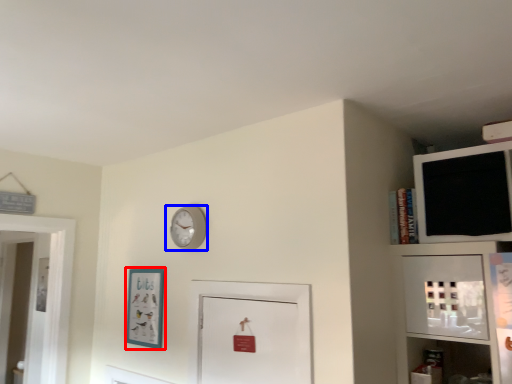
Question: Which object appears farthest to the camera in this image, picture frame (highlighted by a red box) or wall clock (highlighted by a blue box)?

Choices:
 (A) picture frame
 (B) wall clock

Answer: (A)